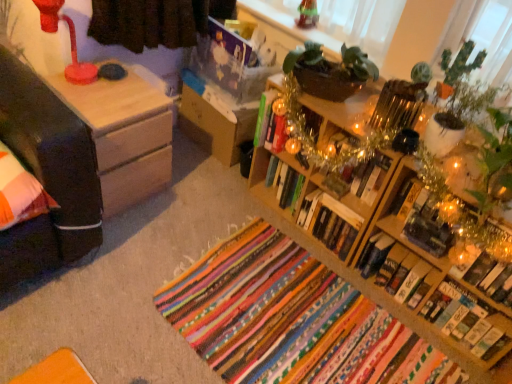
In order to face hardcover book at center-right, which is the sixth book in right-to-left order, should I rotate leftwards or rightwards?

To align with it, rotate right about 12.323°.

What do you see at coordinates (378, 264) in the screenshot? I see `wooden bookshelf at right` at bounding box center [378, 264].

Measure the distance between point (387, 215) and camera.

Point (387, 215) is 1.65 meters away from camera.

Where is `wooden nightstand at left`? The image size is (512, 384). wooden nightstand at left is located at coordinates (124, 134).

In order to click on green matte cactus at upper right in this screenshot , I will do `click(460, 62)`.

This screenshot has width=512, height=384. Find the location of `hardcover book at center-right, the 2th book viewed from the left`. hardcover book at center-right, the 2th book viewed from the left is located at coordinates (330, 222).

Which is in front, hardcover book at center-right, positioned as the 5th book in right-to-left order, or multicolored woven rug at center?

multicolored woven rug at center is more forward.

Which is behind, point (376, 246) or point (337, 364)?

The point (376, 246) is farther.

Based on the photo, is hardcover book at center-right, marked as the 3th book in a left-to-right arrangement, inside or outside of multicolored woven rug at center?

hardcover book at center-right, marked as the 3th book in a left-to-right arrangement, is not inside multicolored woven rug at center, it's outside.

Between hardcover book at center-right, marked as the 3th book in a left-to-right arrangement, and multicolored woven rug at center, which one has smaller width?

Thinner between the two is hardcover book at center-right, marked as the 3th book in a left-to-right arrangement.

Can you tell me how much matte plastic lamp at upper left and hardcover book at center-right, the 2th book viewed from the left, differ in facing direction?

The angle between the facing direction of matte plastic lamp at upper left and the facing direction of hardcover book at center-right, the 2th book viewed from the left, is 88.9 degrees.

Is matte plastic lamp at upper left beside hardcover book at center-right, the 2th book viewed from the left?

matte plastic lamp at upper left is not next to hardcover book at center-right, the 2th book viewed from the left, and they're not touching.

From a real-world perspective, between matte plastic lamp at upper left and hardcover book at center-right, which is the sixth book in right-to-left order, who is vertically lower?

From a 3D spatial view, hardcover book at center-right, which is the sixth book in right-to-left order, is below.

Can you confirm if matte plastic lamp at upper left is wider than hardcover book at center-right, the 2th book viewed from the left?

No.

Which of these two, metallic gold book at center-right, the 4th book in the left-to-right sequence, or hardcover book at lower right, placed as the second book when sorted from right to left, is bigger?

metallic gold book at center-right, the 4th book in the left-to-right sequence, is bigger.

Can you confirm if metallic gold book at center-right, the 4th book in the left-to-right sequence, is thinner than hardcover book at lower right, placed as the second book when sorted from right to left?

In fact, metallic gold book at center-right, the 4th book in the left-to-right sequence, might be wider than hardcover book at lower right, placed as the second book when sorted from right to left.

Considering the sizes of metallic gold book at center-right, the 4th book in the left-to-right sequence, and hardcover book at lower right, which appears as the sixth book when viewed from the left, in the image, is metallic gold book at center-right, the 4th book in the left-to-right sequence, taller or shorter than hardcover book at lower right, which appears as the sixth book when viewed from the left,?

Clearly, metallic gold book at center-right, the 4th book in the left-to-right sequence, is taller compared to hardcover book at lower right, which appears as the sixth book when viewed from the left.

Could hardcover book at lower right, which appears as the sixth book when viewed from the left, be considered to be inside hardcover book at center-right, positioned as the 5th book in right-to-left order?

Actually, hardcover book at lower right, which appears as the sixth book when viewed from the left, is outside hardcover book at center-right, positioned as the 5th book in right-to-left order.

How different are the orientations of hardcover book at center-right, marked as the 3th book in a left-to-right arrangement, and hardcover book at lower right, which appears as the sixth book when viewed from the left, in degrees?

The angular difference between hardcover book at center-right, marked as the 3th book in a left-to-right arrangement, and hardcover book at lower right, which appears as the sixth book when viewed from the left, is 4.25 degrees.

Does point (432, 278) come closer to viewer compared to point (495, 267)?

No, it is not.

Is hardcover book at center-right, positioned as the 5th book in right-to-left order, positioned behind hardcover book at lower right, placed as the second book when sorted from right to left?

That is True.

Who is more distant, matte plastic lamp at upper left or hardcover book at lower right, which appears as the sixth book when viewed from the left?

hardcover book at lower right, which appears as the sixth book when viewed from the left, is more distant.

Can you confirm if matte plastic lamp at upper left is taller than hardcover book at lower right, which appears as the sixth book when viewed from the left?

Yes.

Is matte plastic lamp at upper left facing towards hardcover book at lower right, placed as the second book when sorted from right to left?

No, matte plastic lamp at upper left is not aimed at hardcover book at lower right, placed as the second book when sorted from right to left.

Is point (42, 26) farther from viewer compared to point (487, 284)?

That is True.

Would you consider hardcover book at center, positioned as the 1th book in right-to-left order, to be distant from hardcover book at center-right, marked as the 3th book in a left-to-right arrangement?

hardcover book at center, positioned as the 1th book in right-to-left order, is near hardcover book at center-right, marked as the 3th book in a left-to-right arrangement, not far away.

From the image's perspective, is hardcover book at center, positioned as the 1th book in right-to-left order, located above or below hardcover book at center-right, positioned as the 5th book in right-to-left order?

hardcover book at center, positioned as the 1th book in right-to-left order, is below hardcover book at center-right, positioned as the 5th book in right-to-left order.

Find the location of `the 1st book directly above the hardcover book at center, positioned as the 1th book in right-to-left order (from a real-world perspective)`. the 1st book directly above the hardcover book at center, positioned as the 1th book in right-to-left order (from a real-world perspective) is located at coordinates (398, 270).

From a real-world perspective, is hardcover book at center, marked as the first book in a left-to-right arrangement, located beneath hardcover book at lower right, placed as the second book when sorted from right to left?

Actually, hardcover book at center, marked as the first book in a left-to-right arrangement, is physically above hardcover book at lower right, placed as the second book when sorted from right to left, in the real world.

Consider the image. How different are the orientations of hardcover book at center, marked as the first book in a left-to-right arrangement, and hardcover book at lower right, which appears as the sixth book when viewed from the left, in degrees?

3.53 degrees separate the facing orientations of hardcover book at center, marked as the first book in a left-to-right arrangement, and hardcover book at lower right, which appears as the sixth book when viewed from the left.

Considering the sizes of objects hardcover book at center, the seventh book positioned from the right, and hardcover book at lower right, which appears as the sixth book when viewed from the left, in the image provided, who is bigger, hardcover book at center, the seventh book positioned from the right, or hardcover book at lower right, which appears as the sixth book when viewed from the left,?

Bigger between the two is hardcover book at lower right, which appears as the sixth book when viewed from the left.

Where is `the 5th book behind the multicolored woven rug at center`? The height and width of the screenshot is (384, 512). the 5th book behind the multicolored woven rug at center is located at coordinates (398, 270).

Find the location of `the 2nd book to the right of the matte plastic lamp at upper left, starting your count from the anchor`. the 2nd book to the right of the matte plastic lamp at upper left, starting your count from the anchor is located at coordinates (330, 222).

Considering their positions, is hardcover book at upper right, the 5th book from the left, positioned further to metallic gold book at center-right, the 4th book in the left-to-right sequence, than wooden nightstand at left?

wooden nightstand at left is positioned further to the anchor metallic gold book at center-right, the 4th book in the left-to-right sequence.

When comparing their distances from wooden bookshelf at right, does hardcover book at center, positioned as the 1th book in right-to-left order, or hardcover book at upper right, the 5th book from the left, seem further?

hardcover book at center, positioned as the 1th book in right-to-left order, is further to wooden bookshelf at right.

Based on their spatial positions, is hardcover book at center-right, the 2th book viewed from the left, or metallic gold book at center-right, which is the fourth book from right to left, closer to hardcover book at center, positioned as the 1th book in right-to-left order?

The object closer to hardcover book at center, positioned as the 1th book in right-to-left order, is metallic gold book at center-right, which is the fourth book from right to left.

Which object lies nearer to the anchor point wooden nightstand at center, hardcover book at center, which is the seventh book in left-to-right order, or wooden nightstand at left?

wooden nightstand at left is closer to wooden nightstand at center.

Which object lies nearer to the anchor point hardcover book at lower right, which appears as the sixth book when viewed from the left, metallic gold book at center-right, the 4th book in the left-to-right sequence, or hardcover book at upper right, the third book in the right-to-left sequence?

The object closer to hardcover book at lower right, which appears as the sixth book when viewed from the left, is metallic gold book at center-right, the 4th book in the left-to-right sequence.

Looking at the image, which one is located closer to hardcover book at center, marked as the first book in a left-to-right arrangement, matte plastic lamp at upper left or hardcover book at lower right, which appears as the sixth book when viewed from the left?

matte plastic lamp at upper left is positioned closer to the anchor hardcover book at center, marked as the first book in a left-to-right arrangement.

Looking at the image, which one is located further to matte plastic lamp at upper left, hardcover book at center, positioned as the 1th book in right-to-left order, or wooden nightstand at center?

The object further to matte plastic lamp at upper left is hardcover book at center, positioned as the 1th book in right-to-left order.

Based on their spatial positions, is green matte cactus at upper right or matte plastic lamp at upper left closer to multicolored woven rug at center?

green matte cactus at upper right lies closer to multicolored woven rug at center than the other object.

Find the location of `nightstand between matte plastic lamp at upper left and green matte cactus at upper right in the horizontal direction`. nightstand between matte plastic lamp at upper left and green matte cactus at upper right in the horizontal direction is located at coordinates (215, 118).

Identify the location of shelf between wooden nightstand at left and hardcover book at upper right, the third book in the right-to-left sequence. (378, 264).

The height and width of the screenshot is (384, 512). I want to click on table located between matte plastic lamp at upper left and wooden nightstand at center in the left-right direction, so click(x=124, y=134).

Find the location of `nightstand located between wooden nightstand at left and hardcover book at upper right, the third book in the right-to-left sequence, in the left-right direction`. nightstand located between wooden nightstand at left and hardcover book at upper right, the third book in the right-to-left sequence, in the left-right direction is located at coordinates (215, 118).